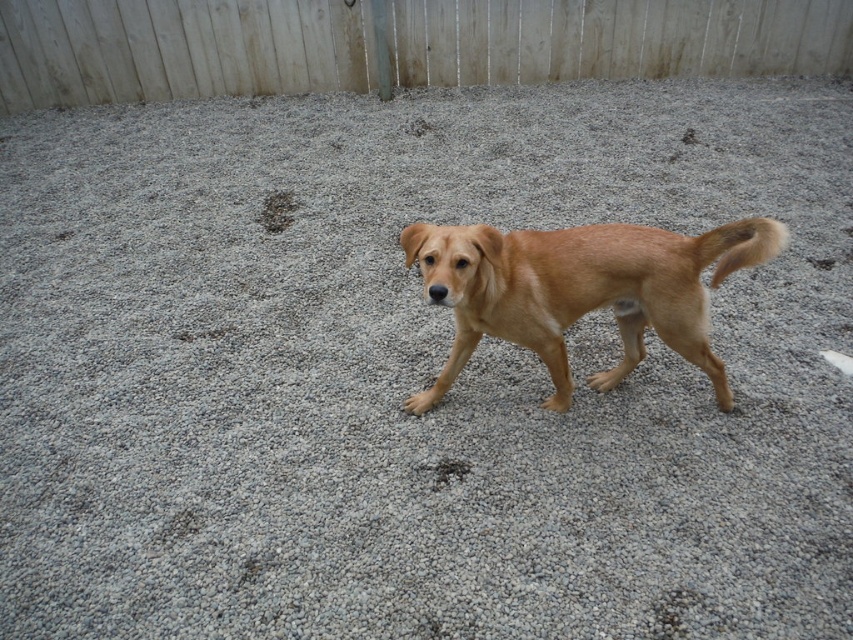
You are a photographer trying to capture a photo of the golden fur dog at center. The white wooden fence at upper center is in the background. Will the fence be taller than the dog in the photo?

The white wooden fence at upper center has a lesser height compared to golden fur dog at center, so the fence will not be taller than the dog in the photo.

You are standing 1.5 meters tall and want to see over the white wooden fence at upper center. The fence is 5.09 meters away from you. If you can jump up to reach 0.5 meters higher than your standing height, will you be able to see over the fence?

The white wooden fence at upper center is 5.09 meters away. Since you can jump to reach 2 meters total height, but the fence height isn not provided in the description, so we cannot determine if you can see over it.

You are a delivery robot with a 3.5 meter maximum delivery range. You are positioned at the golden fur dog at center. Can you deliver a package to the white wooden fence at upper center without moving?

The distance between the white wooden fence at upper center and the golden fur dog at center is 3.73 meters. Since the robot has a maximum delivery range of 3.5 meters, it cannot deliver the package to the white wooden fence at upper center without moving.